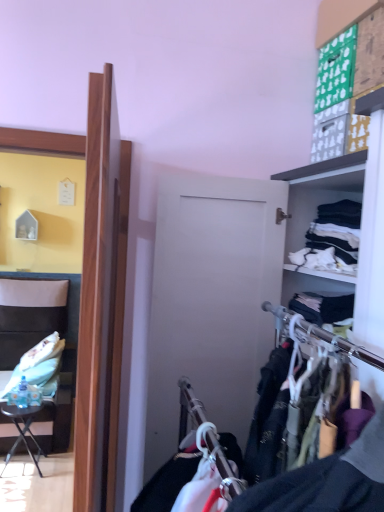
Question: Is leatherette chair at left positioned behind white cotton shirts at right, the 1th clothing in the top-to-bottom sequence?

Choices:
 (A) no
 (B) yes

Answer: (B)

Question: From a real-world perspective, is leatherette chair at left under white cotton shirts at right, which is the second clothing from left to right?

Choices:
 (A) yes
 (B) no

Answer: (A)

Question: Is leatherette chair at left surrounding white cotton shirts at right, the 1th clothing in the top-to-bottom sequence?

Choices:
 (A) yes
 (B) no

Answer: (B)

Question: Is leatherette chair at left smaller than white cotton shirts at right, which is the 2th clothing from back to front?

Choices:
 (A) no
 (B) yes

Answer: (A)

Question: Can you confirm if leatherette chair at left is positioned to the left of white cotton shirts at right, the 1th clothing in the top-to-bottom sequence?

Choices:
 (A) yes
 (B) no

Answer: (A)

Question: From the image's perspective, is white fabric pillow at left, the second clothing from the front, positioned above or below leatherette chair at left?

Choices:
 (A) above
 (B) below

Answer: (B)

Question: Relative to leatherette chair at left, is white fabric pillow at left, arranged as the second clothing when viewed from the right, in front or behind?

Choices:
 (A) front
 (B) behind

Answer: (B)

Question: From their relative heights in the image, would you say white fabric pillow at left, acting as the first clothing starting from the bottom, is taller or shorter than leatherette chair at left?

Choices:
 (A) tall
 (B) short

Answer: (B)

Question: Is white fabric pillow at left, the 1th clothing in the back-to-front sequence, inside or outside of leatherette chair at left?

Choices:
 (A) inside
 (B) outside

Answer: (A)

Question: Is black metal table at lower left situated inside white cotton shirts at right, arranged as the 1th clothing when viewed from the front, or outside?

Choices:
 (A) inside
 (B) outside

Answer: (B)

Question: From the image's perspective, is black metal table at lower left above or below white cotton shirts at right, the 1th clothing in the top-to-bottom sequence?

Choices:
 (A) below
 (B) above

Answer: (A)

Question: Considering the positions of black metal table at lower left and white cotton shirts at right, which is the second clothing from bottom to top, in the image, is black metal table at lower left taller or shorter than white cotton shirts at right, which is the second clothing from bottom to top,?

Choices:
 (A) tall
 (B) short

Answer: (A)

Question: Is point (33, 458) closer or farther from the camera than point (344, 231)?

Choices:
 (A) farther
 (B) closer

Answer: (A)

Question: Considering their positions, is white cotton shirts at right, the 1th clothing in the top-to-bottom sequence, located in front of or behind leatherette chair at left?

Choices:
 (A) front
 (B) behind

Answer: (A)

Question: Would you say white cotton shirts at right, which is the second clothing from left to right, is to the left or to the right of leatherette chair at left in the picture?

Choices:
 (A) left
 (B) right

Answer: (B)